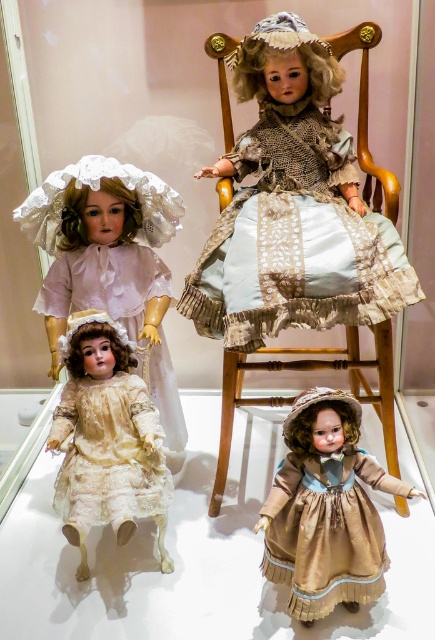
Which doll is positioned at the coordinates point (110, 264)?

The matte white lace doll at center is positioned at point (110, 264).

Where is the light blue satin dress at center located in the image?

The light blue satin dress at center is located at point (294, 243).